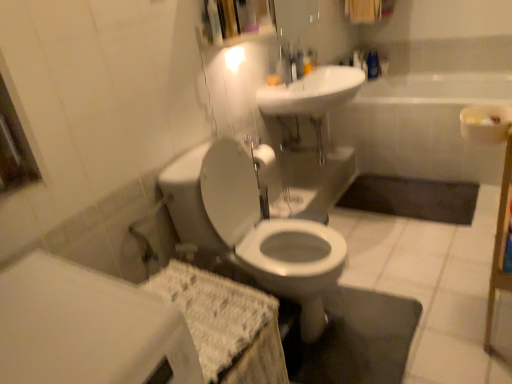
Question: From the image's perspective, relative to white glossy toilet at center, is white glossy sink at upper center above or below?

Choices:
 (A) below
 (B) above

Answer: (B)

Question: Is white glossy sink at upper center wider or thinner than white glossy toilet at center?

Choices:
 (A) thin
 (B) wide

Answer: (A)

Question: Estimate the real-world distances between objects in this image. Which object is farther from the dark gray rubber bath mat at lower center?

Choices:
 (A) white glossy sink at upper center
 (B) white glossy toilet at center
 (C) white ceramic bathtub at center
 (D) white glossy faucet at upper center

Answer: (B)

Question: Which object is the farthest from the white glossy sink at upper center?

Choices:
 (A) dark gray rubber bath mat at lower center
 (B) white ceramic bathtub at center
 (C) white glossy toilet at center
 (D) white glossy faucet at upper center

Answer: (A)